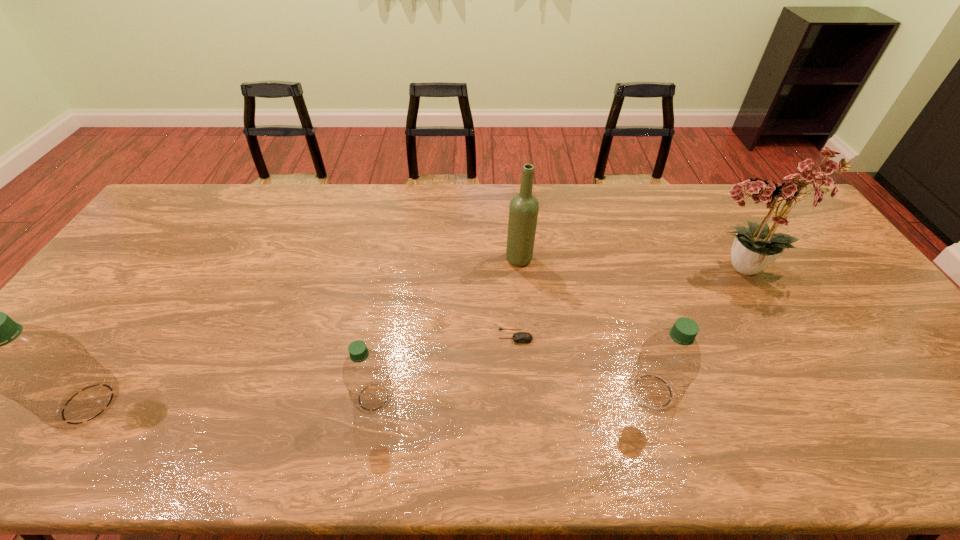
At what (x,y) coordinates should I click in order to perform the action: click on the leftmost object. Please return your answer as a coordinate pair (x, y). This screenshot has width=960, height=540. Looking at the image, I should click on (48, 372).

This screenshot has height=540, width=960. I want to click on the leftmost water bottle, so click(x=48, y=372).

Where is `the fifth object from right to left`? the fifth object from right to left is located at coordinates (365, 374).

Identify the location of the shortest water bottle. Image resolution: width=960 pixels, height=540 pixels. (365, 374).

Locate an element on the screen. The image size is (960, 540). the rightmost water bottle is located at coordinates (669, 361).

Image resolution: width=960 pixels, height=540 pixels. Identify the location of the third shortest object. (669, 361).

The image size is (960, 540). I want to click on wine bottle, so click(x=523, y=212).

Where is `mouse`? mouse is located at coordinates click(x=520, y=337).

The image size is (960, 540). I want to click on the shortest object, so click(520, 337).

Where is `the tallest object`? the tallest object is located at coordinates (754, 248).